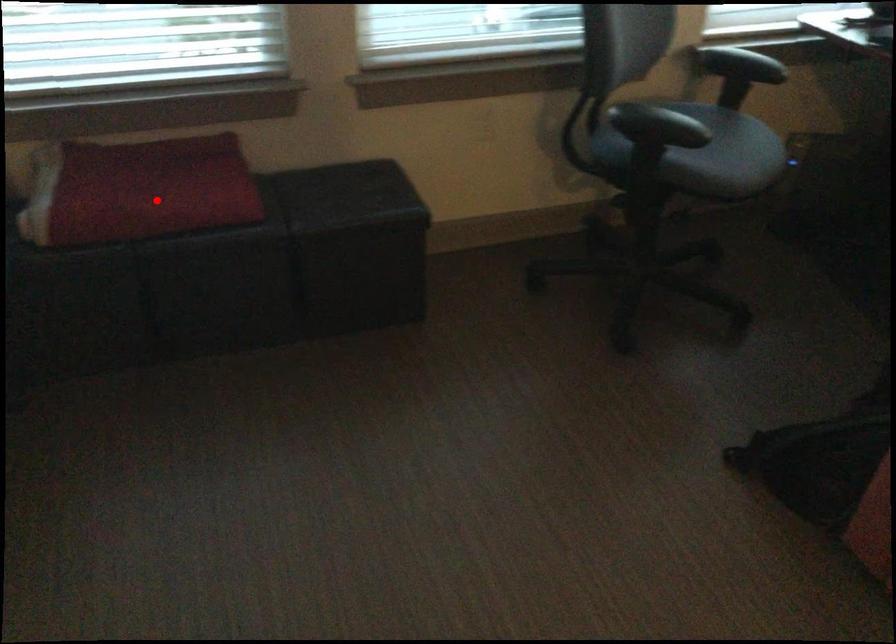
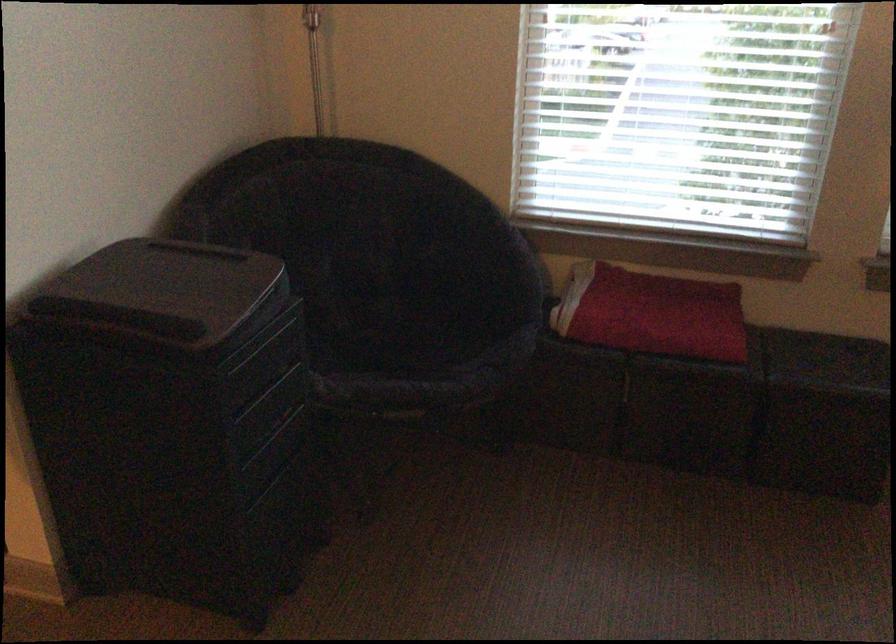
Where in the second image is the point corresponding to the highlighted location from the first image?

(651, 313)